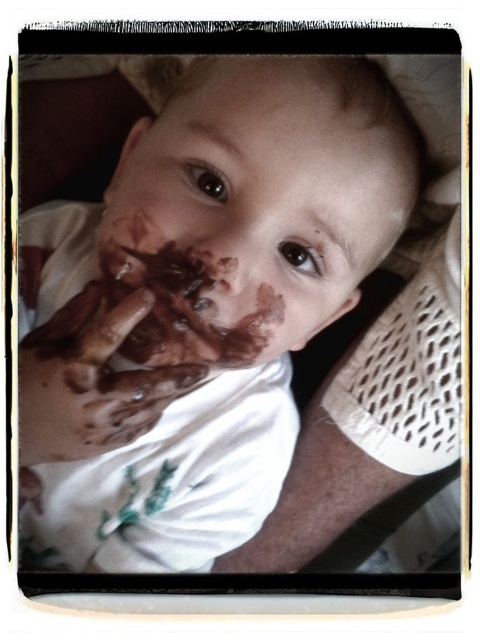
Question: Is chocolate matte hands at center above chocolatey skin at center?

Choices:
 (A) yes
 (B) no

Answer: (A)

Question: Is chocolate matte hands at center thinner than chocolatey skin at center?

Choices:
 (A) yes
 (B) no

Answer: (B)

Question: Which object is positioned closest to the chocolate matte hands at center?

Choices:
 (A) chocolatey skin at center
 (B) chocolate matte face at center

Answer: (B)

Question: Based on their relative distances, which object is nearer to the chocolate matte face at center?

Choices:
 (A) chocolatey skin at center
 (B) chocolate matte hands at center

Answer: (B)

Question: Which object is closer to the camera taking this photo?

Choices:
 (A) chocolatey skin at center
 (B) chocolate matte face at center
 (C) chocolate matte hands at center

Answer: (B)

Question: Is chocolate matte hands at center smaller than chocolatey skin at center?

Choices:
 (A) no
 (B) yes

Answer: (A)